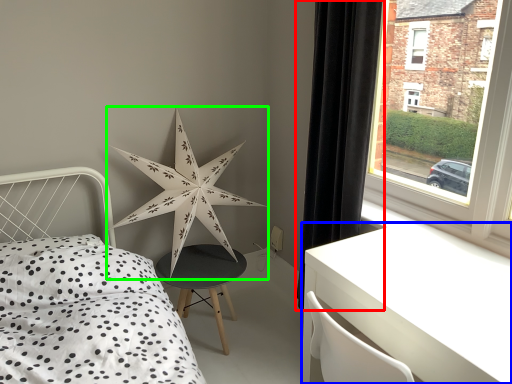
Question: Which object is the closest to the curtain (highlighted by a red box)? Choose among these: table (highlighted by a blue box) or star (highlighted by a green box).

Choices:
 (A) table
 (B) star

Answer: (A)